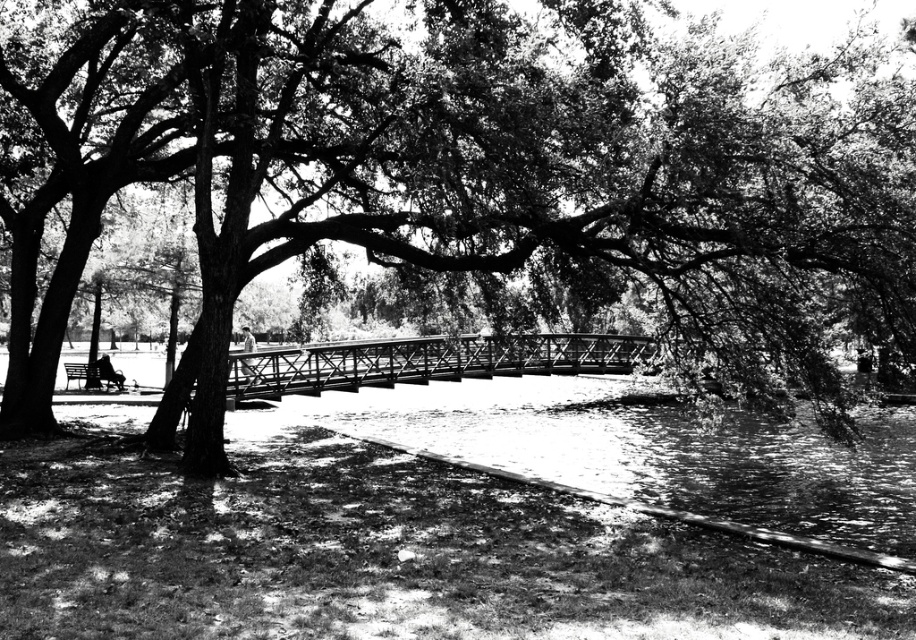
You are planning to take a photo of the metallic bridge at center and the wooden bench at lower left. Which object should you focus on if you want to capture the larger subject in your shot?

The metallic bridge at center is bigger than the wooden bench at lower left, so you should focus on the metallic bridge at center to capture the larger subject.

You are standing at the point labeled as point (431,362) in the park scene. What structure are you currently standing on?

The point (431,362) is on the metallic bridge at center, so you are standing on the metallic bridge at center.